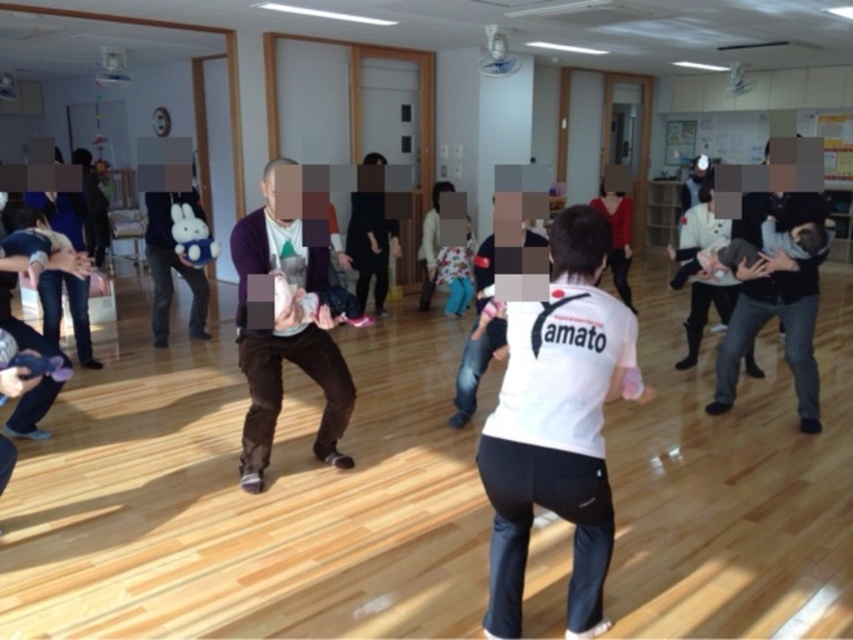
You are a participant in the exercise class and need to quickly grab a water bottle. The water bottle is placed between the white matte shirt at center and the brown cotton sweater at center. Which direction should you move to reach it?

The water bottle is between the white matte shirt at center and the brown cotton sweater at center. Since the white matte shirt at center is located below the brown cotton sweater at center, you should move downward towards the white matte shirt at center to reach the water bottle.

You are organizing a clothing display and need to arrange the white matte shirt at center and the brown cotton sweater at center side by side. Based on their sizes, which one should be placed on the left to ensure they fit within a 1.5 meter wide display area?

The white matte shirt at center has a larger width than the brown cotton sweater at center. To fit within the 1.5 meter display area, place the wider white matte shirt at center on the left and the narrower brown cotton sweater at center on the right, ensuring their combined width does not exceed the available space.